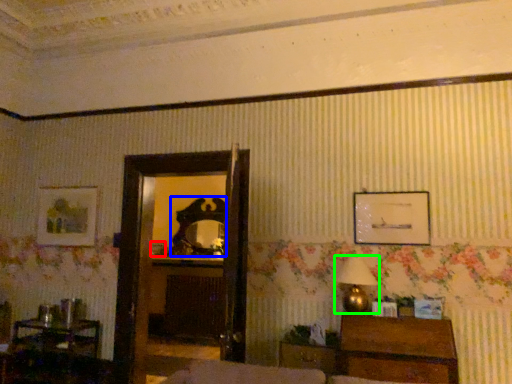
Question: Which is nearer to the picture frame (highlighted by a red box)? mirror (highlighted by a blue box) or table lamp (highlighted by a green box).

Choices:
 (A) mirror
 (B) table lamp

Answer: (A)